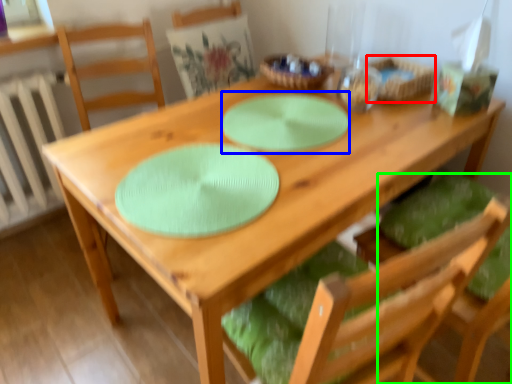
Question: Which object is positioned farthest from basket (highlighted by a red box)? Select from glass plate (highlighted by a blue box) and chair (highlighted by a green box).

Choices:
 (A) glass plate
 (B) chair

Answer: (B)